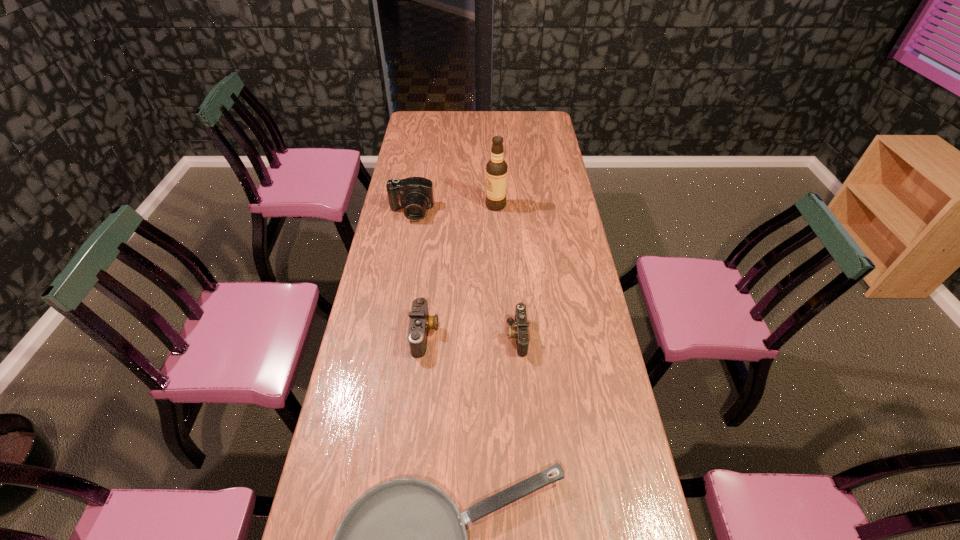
You are a GUI agent. You are given a task and a screenshot of the screen. Output one action in this format:
    pyautogui.click(x=<x>, y=<y>)
    Task: Click on the alcohol
    
    Given the screenshot: What is the action you would take?
    pyautogui.click(x=496, y=169)

Where is `the second tallest object`? This screenshot has height=540, width=960. the second tallest object is located at coordinates (415, 194).

I want to click on the tallest camera, so click(415, 194).

I want to click on the rightmost camera, so click(520, 331).

Find the location of a particular element. The height and width of the screenshot is (540, 960). vacant space located 0.200m on the label of the alcohol is located at coordinates (439, 206).

Locate an element on the screen. This screenshot has height=540, width=960. blank area located on the label of the alcohol is located at coordinates (434, 206).

Where is `free space located 0.160m on the label of the alcohol`? Image resolution: width=960 pixels, height=540 pixels. free space located 0.160m on the label of the alcohol is located at coordinates (448, 206).

Find the location of a particular element. This screenshot has height=540, width=960. blank area located 0.340m on the lens of the second tallest object is located at coordinates (398, 284).

The height and width of the screenshot is (540, 960). I want to click on vacant space located 0.280m on the front-facing side of the rightmost camera, so click(420, 336).

The height and width of the screenshot is (540, 960). In order to click on vacant space located 0.280m on the front-facing side of the rightmost camera in this screenshot , I will do `click(420, 336)`.